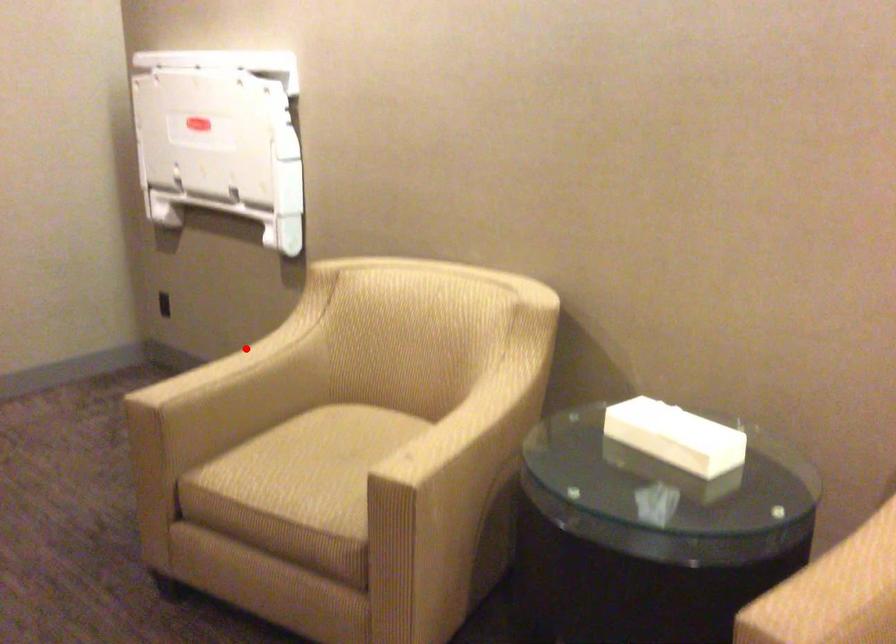
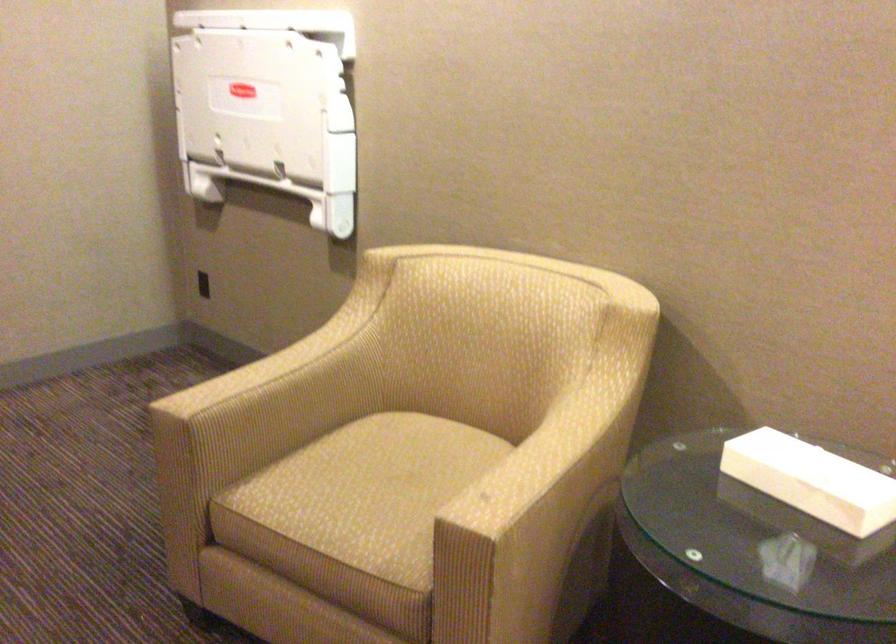
Question: I am providing you with two images of the same scene from different viewpoints. A red point is shown in image1. For the corresponding object point in image2, is it positioned nearer or farther from the camera?

Choices:
 (A) Nearer
 (B) Farther

Answer: (A)